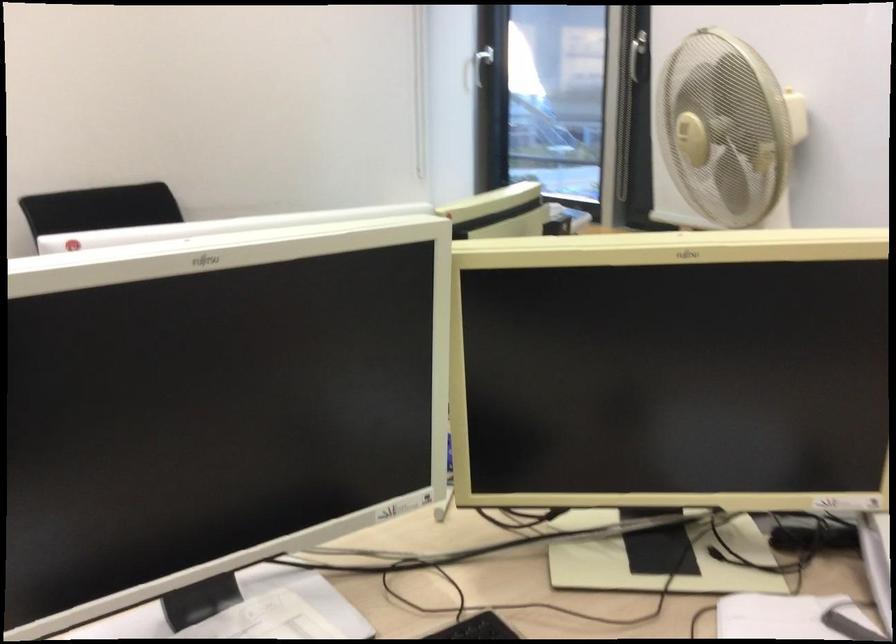
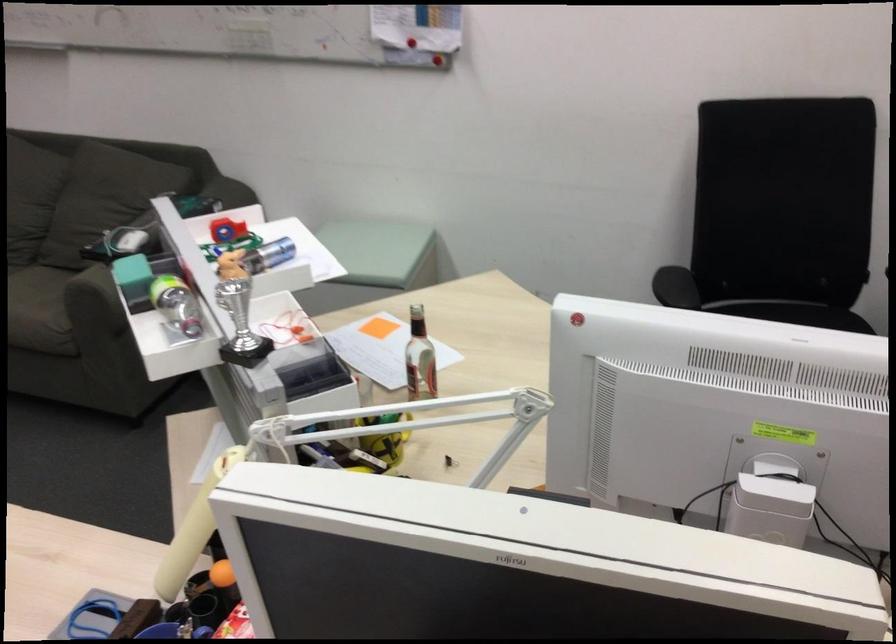
How did the camera likely rotate?

The camera rotated toward left-down.